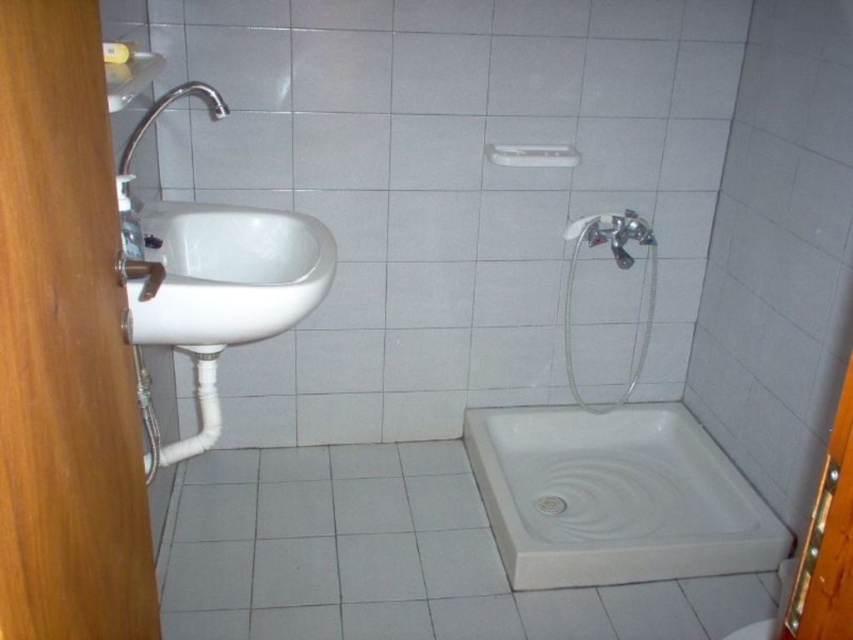
Does matte silver shower head at upper right have a greater width compared to matte silver faucet at upper left?

Indeed, matte silver shower head at upper right has a greater width compared to matte silver faucet at upper left.

Can you confirm if matte silver shower head at upper right is thinner than matte silver faucet at upper left?

No.

Does point (601, 216) come farther from viewer compared to point (135, 145)?

Yes, point (601, 216) is farther from viewer.

Locate an element on the screen. This screenshot has height=640, width=853. matte silver shower head at upper right is located at coordinates (618, 268).

Is white smooth bathtub at lower center thinner than matte silver shower head at upper right?

No, white smooth bathtub at lower center is not thinner than matte silver shower head at upper right.

Does white smooth bathtub at lower center have a greater height compared to matte silver shower head at upper right?

Incorrect, white smooth bathtub at lower center's height is not larger of matte silver shower head at upper right's.

Where is `white smooth bathtub at lower center`? This screenshot has width=853, height=640. white smooth bathtub at lower center is located at coordinates (614, 497).

Can you confirm if white glossy sink at left is bigger than matte silver shower head at upper right?

Indeed, white glossy sink at left has a larger size compared to matte silver shower head at upper right.

Who is more forward, (184, 266) or (577, 404)?

Point (184, 266) is more forward.

Between point (299, 292) and point (628, 262), which one is positioned in front?

Point (299, 292)

Identify the location of white glossy sink at left. Image resolution: width=853 pixels, height=640 pixels. (229, 275).